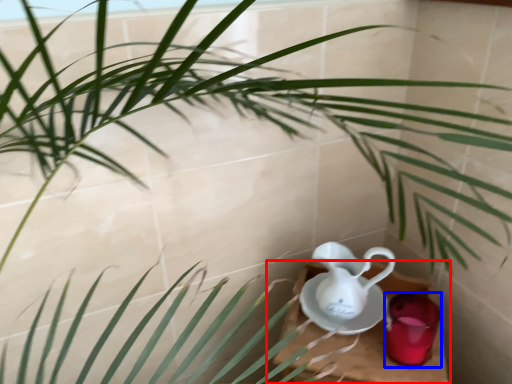
Question: Which object appears farthest to the camera in this image, table (highlighted by a red box) or tableware (highlighted by a blue box)?

Choices:
 (A) table
 (B) tableware

Answer: (B)